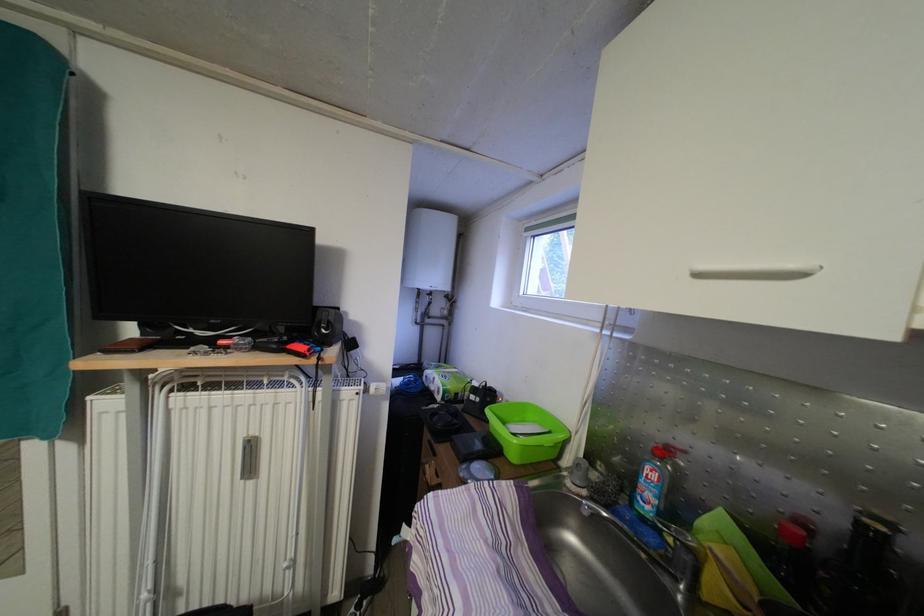
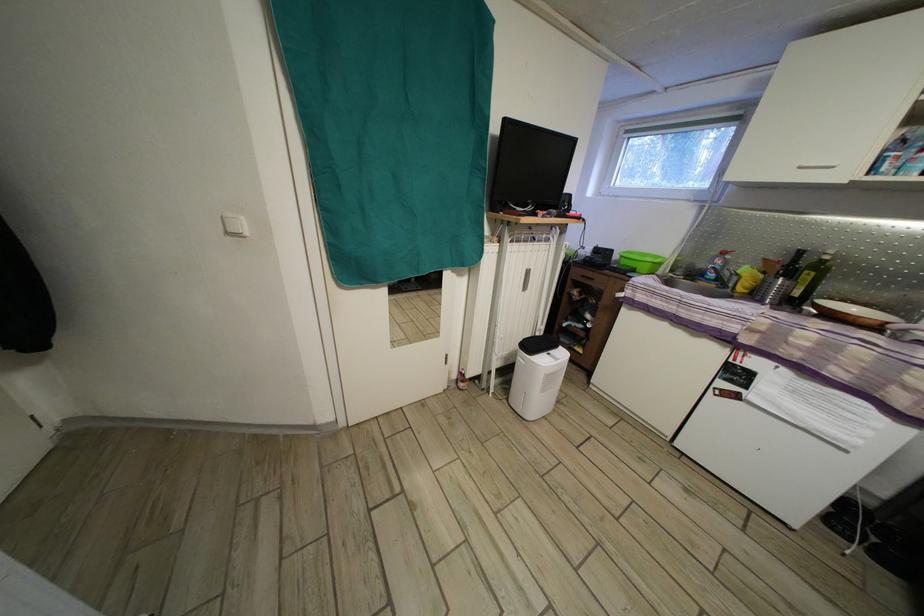
The images are taken continuously from a first-person perspective. In which direction are you moving?

The cameraman moved toward left, backward.